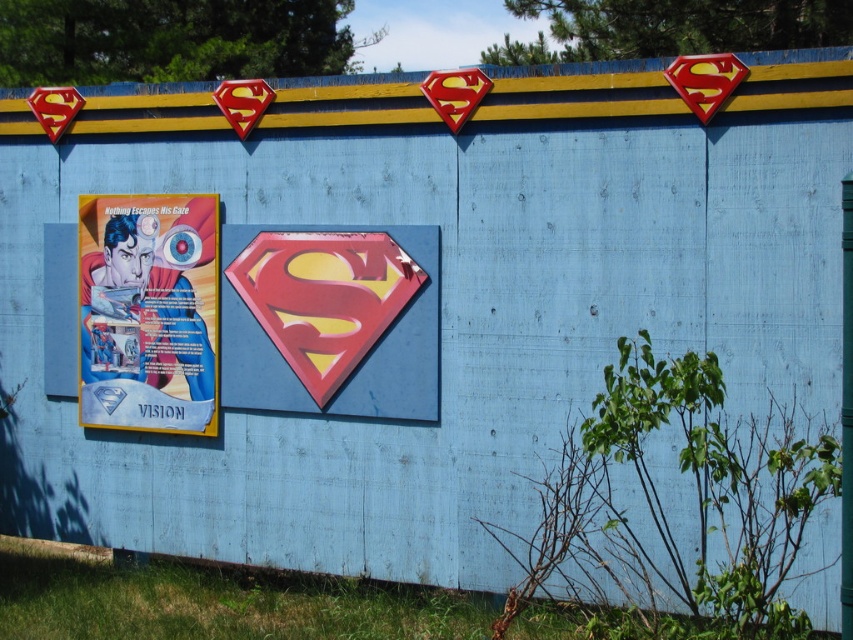
Can you confirm if metallic silver comic book at center is positioned to the right of matte paper poster at left?

Correct, you'll find metallic silver comic book at center to the right of matte paper poster at left.

Is metallic silver comic book at center further to the viewer compared to matte paper poster at left?

That is False.

Between point (347, 396) and point (88, 289), which one is positioned in front?

Point (347, 396) is in front.

What are the coordinates of `metallic silver comic book at center` in the screenshot? It's located at (331, 320).